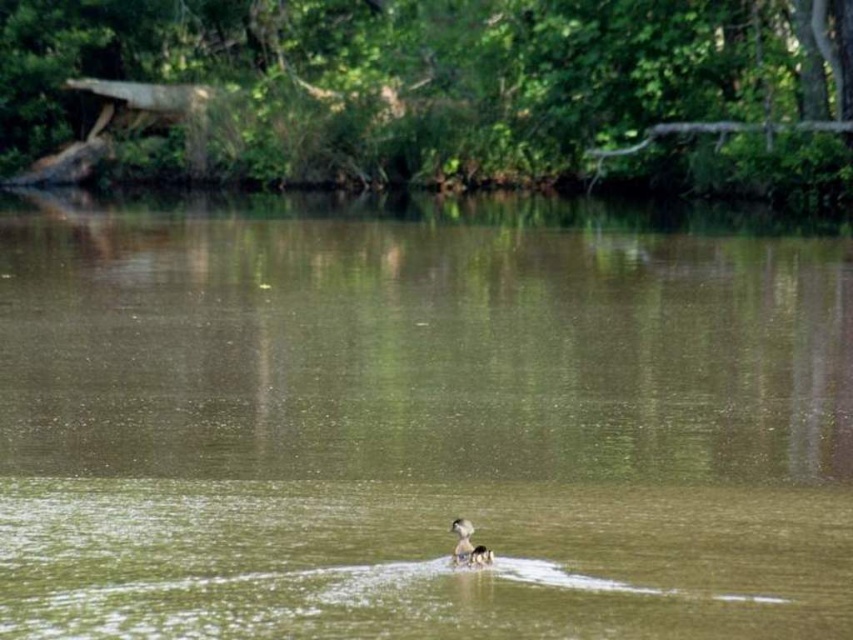
Does point (137, 273) come in front of point (453, 532)?

No.

This screenshot has height=640, width=853. Describe the element at coordinates (421, 419) in the screenshot. I see `greenish murky water at center` at that location.

Identify the location of greenish murky water at center. (421, 419).

Is white matte duck at center smaller than brown fuzzy duck at center?

No.

Is white matte duck at center positioned before brown fuzzy duck at center?

That is True.

The height and width of the screenshot is (640, 853). What are the coordinates of `white matte duck at center` in the screenshot? It's located at (468, 547).

This screenshot has height=640, width=853. What do you see at coordinates (421, 419) in the screenshot?
I see `greenish murky water at center` at bounding box center [421, 419].

Who is more forward, [349,237] or [465,531]?

Point [465,531]

Image resolution: width=853 pixels, height=640 pixels. In order to click on greenish murky water at center in this screenshot , I will do `click(421, 419)`.